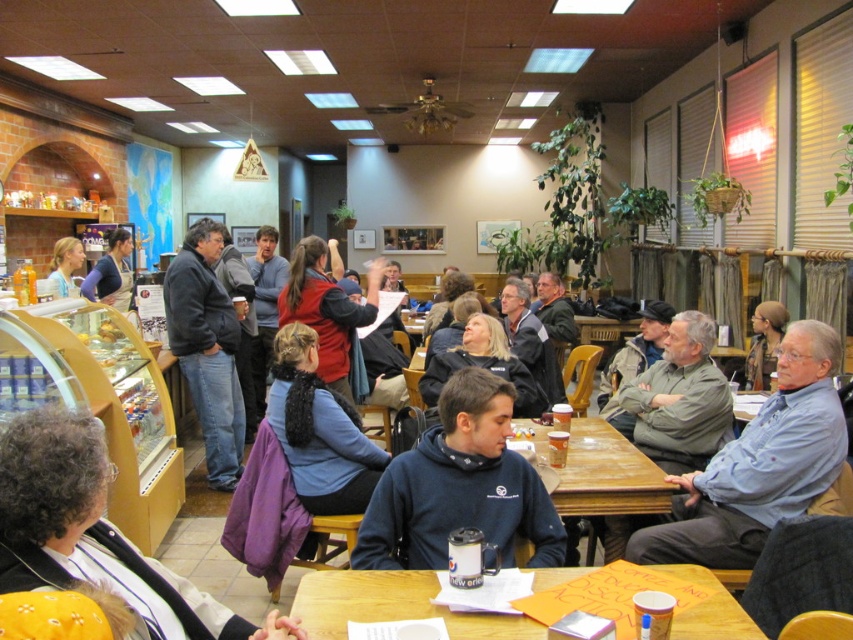
You are organizing a small event in this space and need to place a decorative item that is 1.2 meters wide on a surface. Given the white textured sweater at lower left and the wooden table at center, which surface can accommodate the item based on their widths?

The wooden table at center can accommodate the decorative item since it has a greater width than the white textured sweater at lower left, and the item is 1.2 meters wide.

You are a customer in the cafe and you want to ask the staff about the menu. Which item, the navy blue hoodie at center or the matte blue apron at left, is closer to your eye level?

The navy blue hoodie at center has a lesser height compared to matte blue apron at left, so the matte blue apron at left is closer to your eye level.